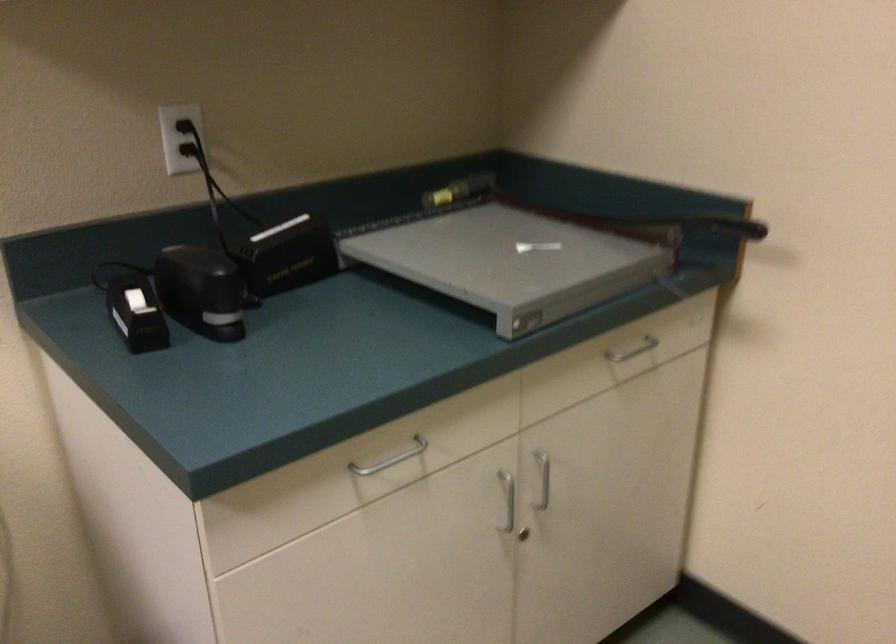
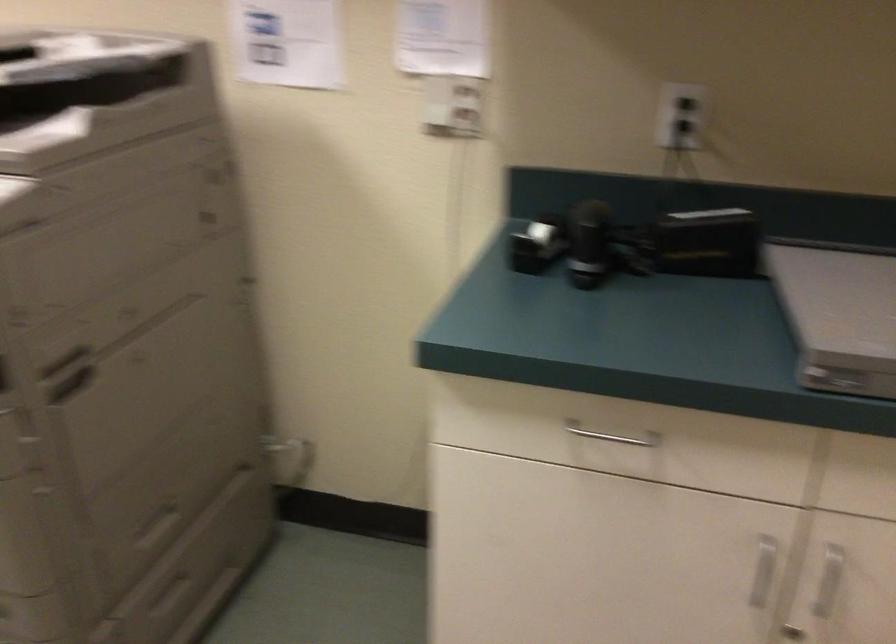
Question: How did the camera likely rotate?

Choices:
 (A) Left
 (B) Right
 (C) Up
 (D) Down

Answer: (A)